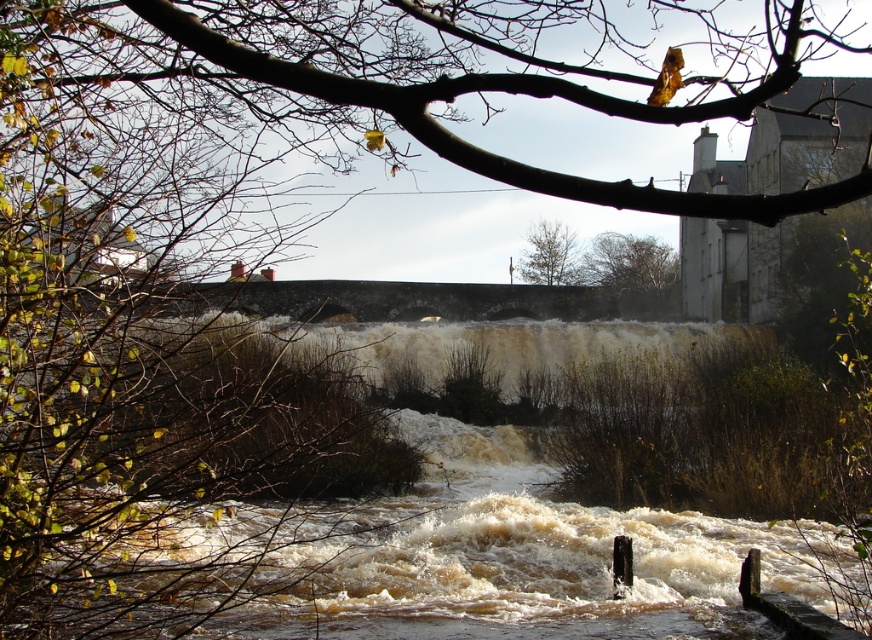
What do you see at coordinates (634, 273) in the screenshot? The image size is (872, 640). I see `brown leafy tree at upper center` at bounding box center [634, 273].

Who is positioned more to the right, brown leafy tree at upper center or green leafy tree at upper center?

brown leafy tree at upper center is more to the right.

Find the location of a particular element. This screenshot has height=640, width=872. brown leafy tree at upper center is located at coordinates (634, 273).

Locate an element on the screen. This screenshot has width=872, height=640. brown leafy tree at upper center is located at coordinates (634, 273).